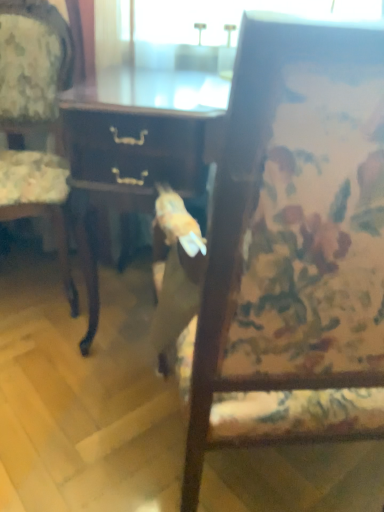
In order to click on vacant region to the left of wooden chair at center, which is the 2th chair in left-to-right order in this screenshot , I will do [74, 419].